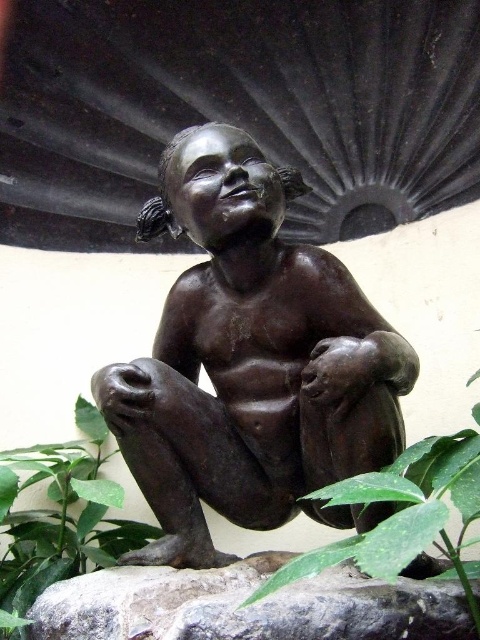
Question: Is bronze statue at center further to camera compared to green leafy plant at lower left?

Choices:
 (A) yes
 (B) no

Answer: (B)

Question: Is gray rough stone at lower center positioned before green leafy plant at lower left?

Choices:
 (A) no
 (B) yes

Answer: (B)

Question: Estimate the real-world distances between objects in this image. Which object is closer to the gray rough stone at lower center?

Choices:
 (A) bronze statue at center
 (B) green leafy plant at lower center
 (C) green leafy plant at lower left

Answer: (B)

Question: Which point is closer to the camera taking this photo?

Choices:
 (A) (402, 524)
 (B) (16, 625)
 (C) (276, 556)
 (D) (279, 266)

Answer: (A)

Question: Does gray rough stone at lower center have a lesser width compared to green leafy plant at lower left?

Choices:
 (A) yes
 (B) no

Answer: (B)

Question: Which of the following is the closest to the observer?

Choices:
 (A) bronze statue at center
 (B) gray rough stone at lower center
 (C) green leafy plant at lower left

Answer: (B)